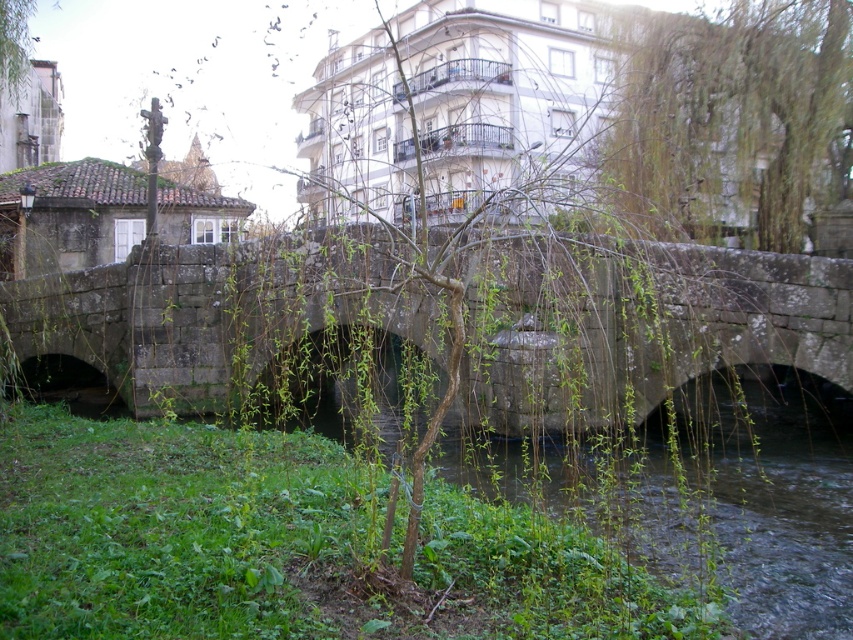
Does point (753, 353) come behind point (647, 209)?

No, it is in front of (647, 209).

I want to click on stone bridge at center, so click(631, 324).

Measure the distance between point [827,372] and camera.

Point [827,372] and camera are 14.25 meters apart from each other.

Where is `stone bridge at center`? The height and width of the screenshot is (640, 853). stone bridge at center is located at coordinates (631, 324).